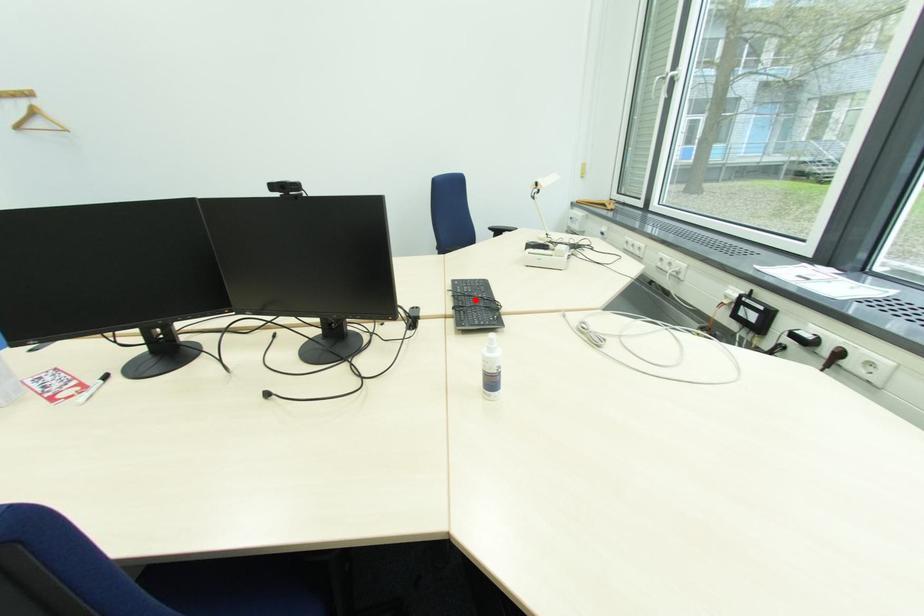
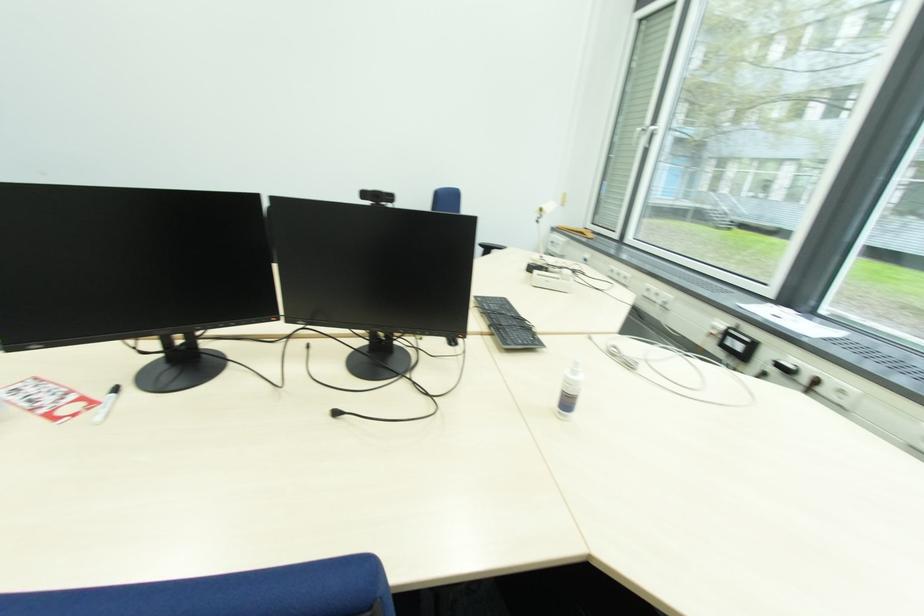
Find the pixel in the second image that matches the highlighted location in the first image.

(506, 318)